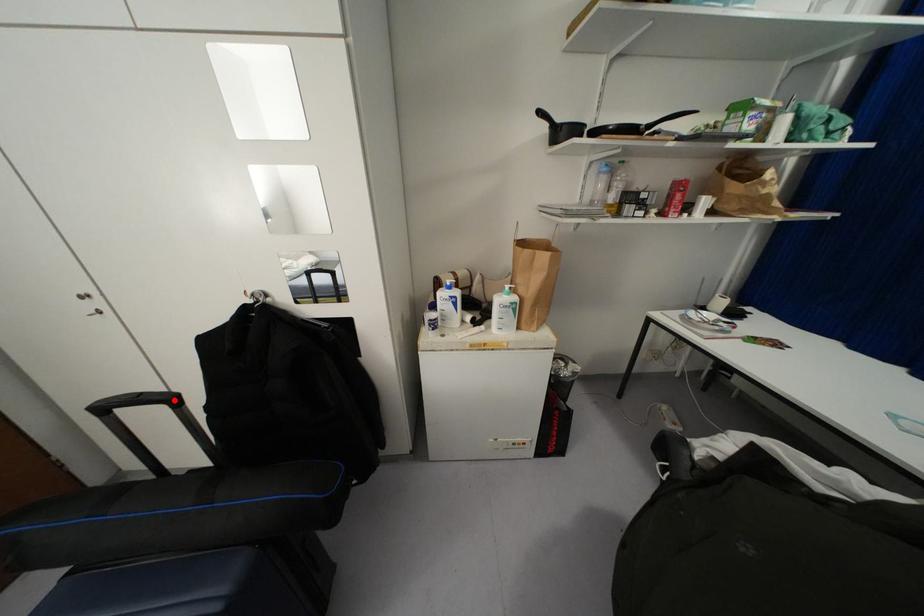
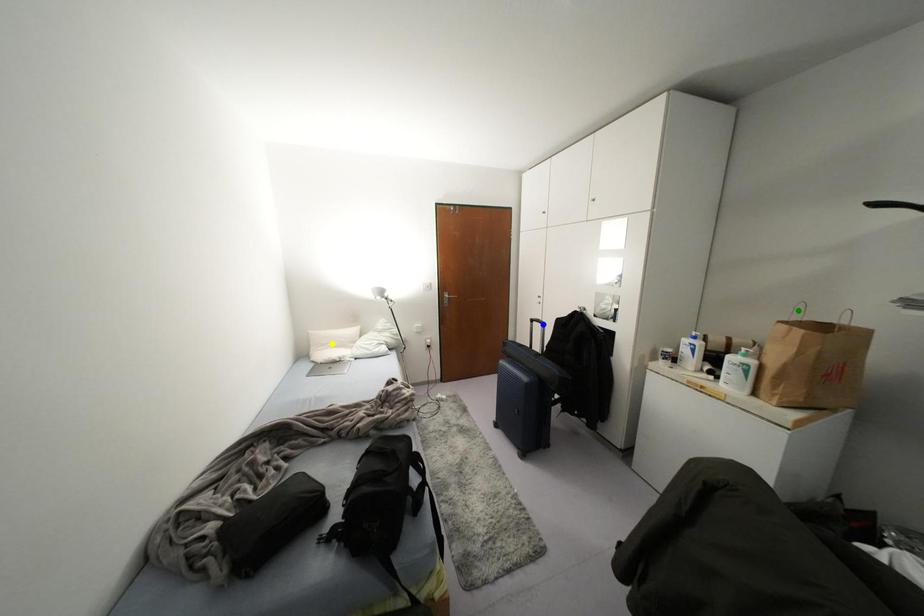
Question: I am providing you with two images of the same scene from different viewpoints. A red point is marked on the first image. You are given multiple points on the second image. Which point in image 2 is actually the same real-world point as the red point in image 1?

Choices:
 (A) yellow point
 (B) green point
 (C) blue point

Answer: (C)